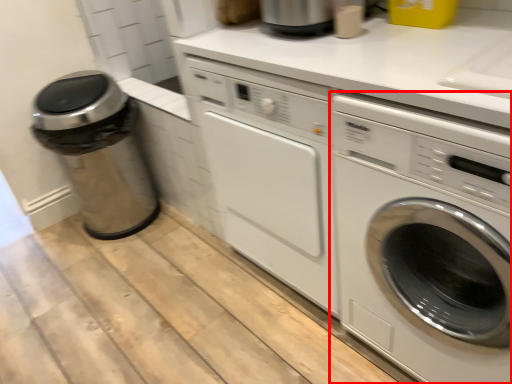
Question: Where is washing machine (annotated by the red box) located in relation to garbage in the image?

Choices:
 (A) left
 (B) right

Answer: (B)